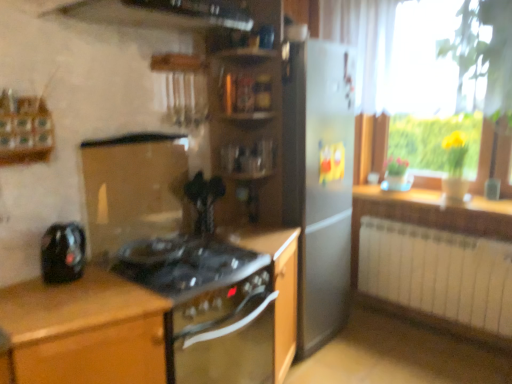
Question: Considering the positions of point (449, 248) and point (412, 142), is point (449, 248) closer or farther from the camera than point (412, 142)?

Choices:
 (A) farther
 (B) closer

Answer: (B)

Question: Is white metallic radiator at lower right in front of or behind yellow glass vase at right in the image?

Choices:
 (A) behind
 (B) front

Answer: (B)

Question: Estimate the real-world distances between objects in this image. Which object is farther from the black matte oven at center, which ranks as the 3th cabinetry in left-to-right order?

Choices:
 (A) brown wood cabinet at left, the 1th cabinetry in the left-to-right sequence
 (B) black glossy kettle at left
 (C) white metallic radiator at lower right
 (D) black glass stove at center, which is the 2th cabinetry from left to right
 (E) black glass gas stove at center

Answer: (C)

Question: Considering the real-world distances, which object is closest to the black glossy kettle at left?

Choices:
 (A) wooden countertop at right
 (B) black glossy vase at center
 (C) yellow glass vase at right
 (D) black matte oven at center, which ranks as the 3th cabinetry in left-to-right order
 (E) white metallic radiator at lower right

Answer: (B)